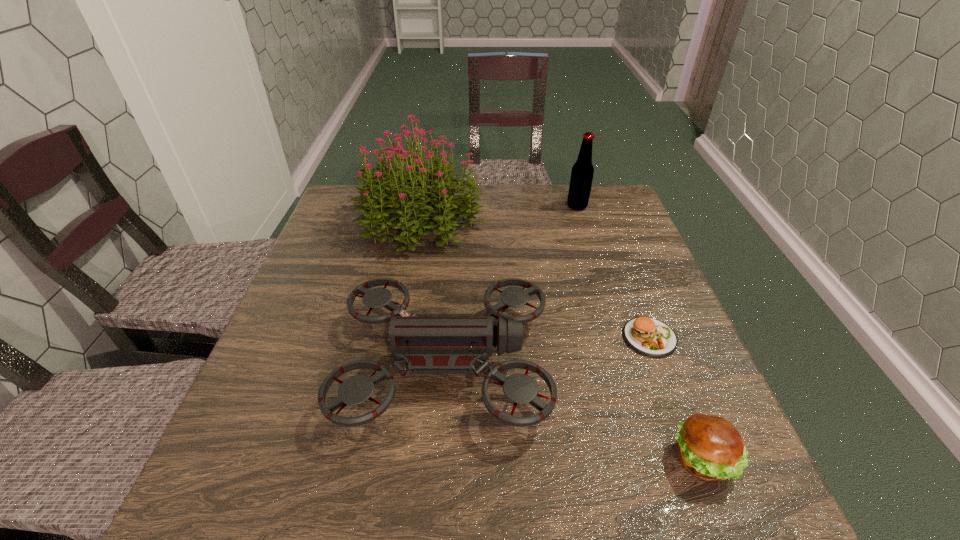
Where is `bouquet that is at the far edge`? The image size is (960, 540). bouquet that is at the far edge is located at coordinates (412, 190).

Where is `beer bottle situated at the far edge`? The height and width of the screenshot is (540, 960). beer bottle situated at the far edge is located at coordinates (582, 172).

This screenshot has height=540, width=960. I want to click on object situated at the near edge, so click(710, 448).

Locate an element on the screen. object located in the left edge section of the desktop is located at coordinates (412, 190).

I want to click on beer bottle located at the right edge, so click(582, 172).

This screenshot has height=540, width=960. What are the coordinates of `hamburger that is at the right edge` in the screenshot? It's located at (710, 448).

Identify the location of patty present at the right edge. (651, 337).

Where is `object positioned at the far left corner`? object positioned at the far left corner is located at coordinates (412, 190).

You are a GUI agent. You are given a task and a screenshot of the screen. Output one action in this format:
    pyautogui.click(x=<x>, y=<y>)
    Task: Click on the object present at the far right corner
    
    Given the screenshot: What is the action you would take?
    pyautogui.click(x=582, y=172)

Locate an element on the screen. This screenshot has width=960, height=540. object that is positioned at the near right corner is located at coordinates (710, 448).